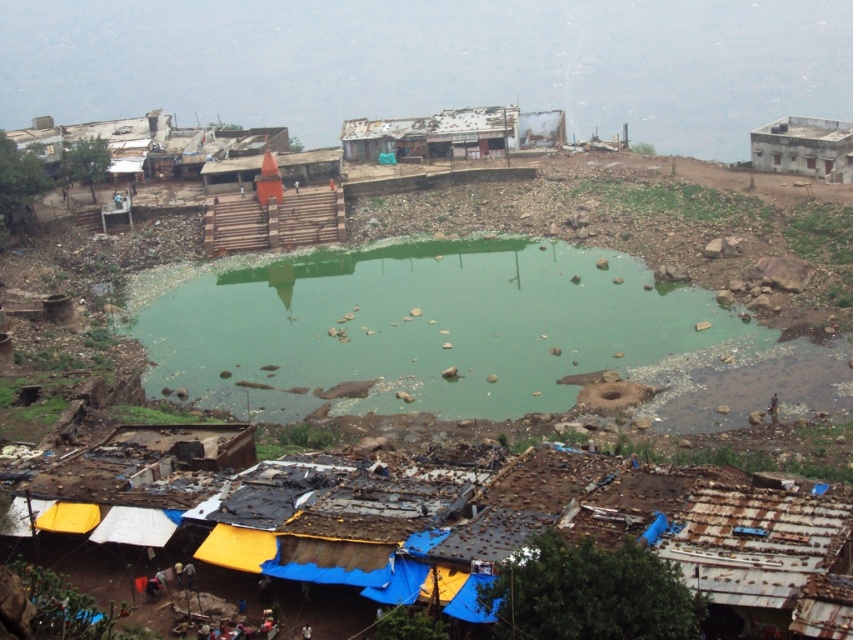
Describe the element at coordinates (422, 328) in the screenshot. I see `green murky water at center` at that location.

This screenshot has height=640, width=853. In order to click on green murky water at center in this screenshot , I will do [x=422, y=328].